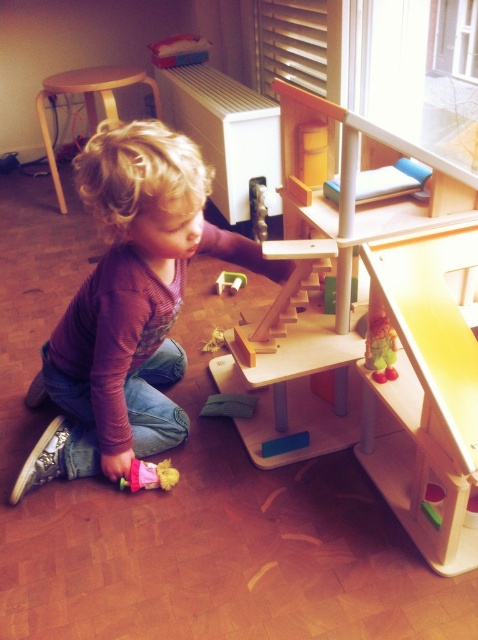
You are a parent trying to place a small plant pot on the light brown wooden stool at upper left. The plant pot has a diameter of 20 cm. Can you determine if the stool will be able to support the pot?

The light brown wooden stool at upper left is positioned at point (87,100), but without information about its size or load capacity, it is impossible to determine if it can support the plant pot.